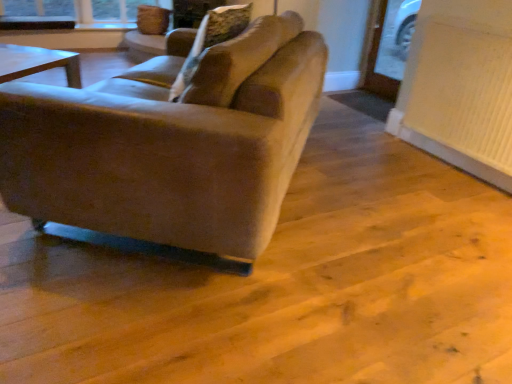
Question: Is suede-like beige pillow at center located outside suede-like beige couch at center?

Choices:
 (A) yes
 (B) no

Answer: (B)

Question: From a real-world perspective, is suede-like beige pillow at center below suede-like beige couch at center?

Choices:
 (A) yes
 (B) no

Answer: (B)

Question: From the image's perspective, is suede-like beige pillow at center on suede-like beige couch at center?

Choices:
 (A) no
 (B) yes

Answer: (B)

Question: Is suede-like beige couch at center completely or partially inside suede-like beige pillow at center?

Choices:
 (A) no
 (B) yes

Answer: (A)

Question: Can you confirm if suede-like beige pillow at center is bigger than suede-like beige couch at center?

Choices:
 (A) no
 (B) yes

Answer: (A)

Question: Does suede-like beige pillow at center have a lesser height compared to suede-like beige couch at center?

Choices:
 (A) no
 (B) yes

Answer: (B)

Question: Is suede-like beige couch at center at the right side of suede-like beige pillow at center?

Choices:
 (A) yes
 (B) no

Answer: (B)

Question: Is suede-like beige couch at center not close to suede-like beige pillow at center?

Choices:
 (A) yes
 (B) no

Answer: (B)

Question: Is suede-like beige couch at center outside of suede-like beige pillow at center?

Choices:
 (A) no
 (B) yes

Answer: (B)

Question: Is the position of suede-like beige couch at center more distant than that of suede-like beige pillow at center?

Choices:
 (A) yes
 (B) no

Answer: (B)

Question: Could you tell me if suede-like beige couch at center is turned towards suede-like beige pillow at center?

Choices:
 (A) yes
 (B) no

Answer: (A)

Question: From a real-world perspective, is suede-like beige couch at center below suede-like beige pillow at center?

Choices:
 (A) yes
 (B) no

Answer: (A)

Question: From the image's perspective, is suede-like beige couch at center below white textured radiator at lower right?

Choices:
 (A) no
 (B) yes

Answer: (B)